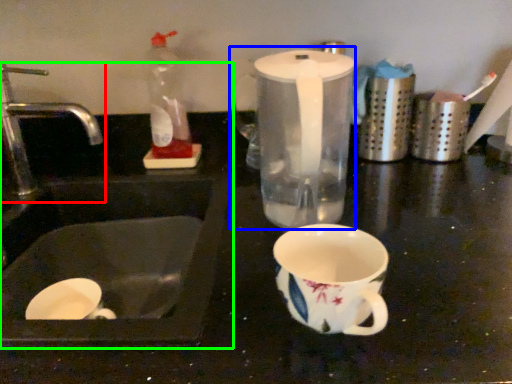
Question: Considering the real-world distances, which object is farthest from tap (highlighted by a red box)? blender (highlighted by a blue box) or sink (highlighted by a green box)?

Choices:
 (A) blender
 (B) sink

Answer: (A)